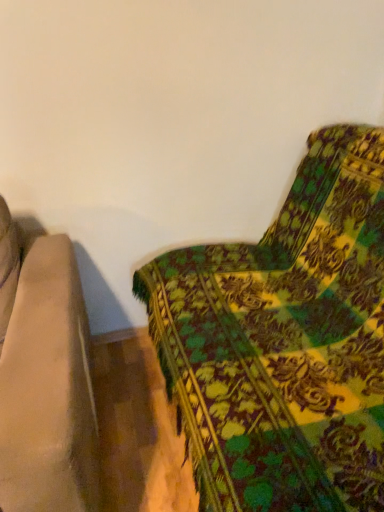
Question: Should I look upward or downward to see green patterned fabric at right?

Choices:
 (A) down
 (B) up

Answer: (A)